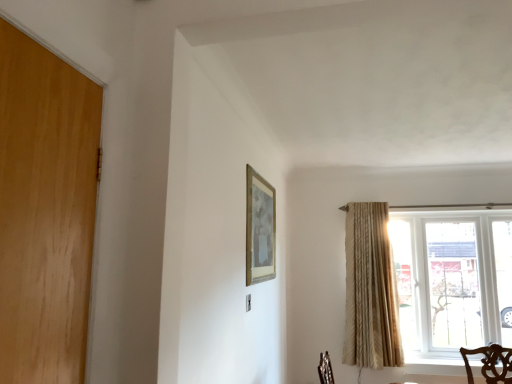
Question: In terms of height, does gold metallic picture frame at upper center look taller or shorter compared to clear glass window at right?

Choices:
 (A) tall
 (B) short

Answer: (B)

Question: Is point (246, 251) closer or farther from the camera than point (468, 319)?

Choices:
 (A) farther
 (B) closer

Answer: (B)

Question: Which is nearer to the clear glass window at right?

Choices:
 (A) gold metallic picture frame at upper center
 (B) beige textured curtain at right

Answer: (B)

Question: Based on their relative distances, which object is nearer to the clear glass window at right?

Choices:
 (A) gold metallic picture frame at upper center
 (B) beige textured curtain at right

Answer: (B)